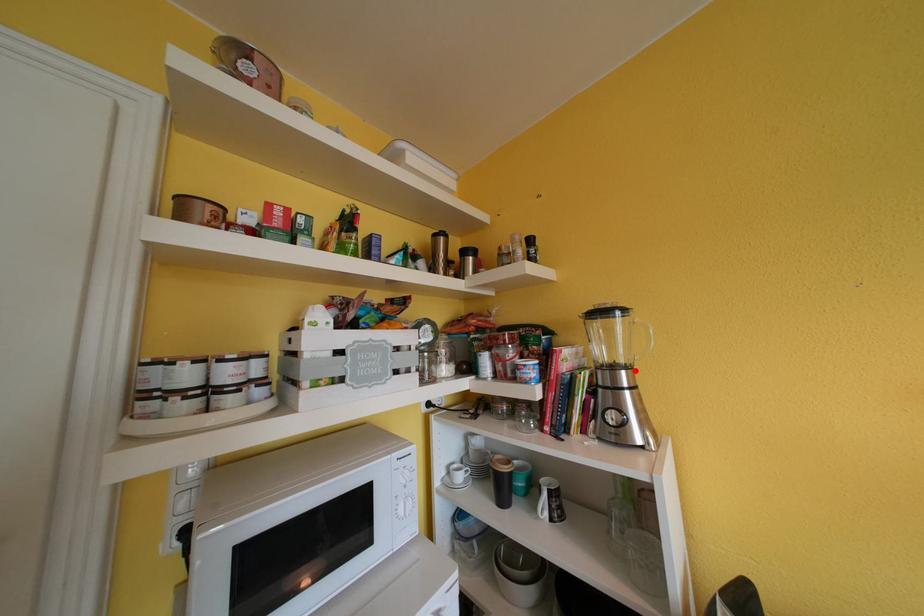
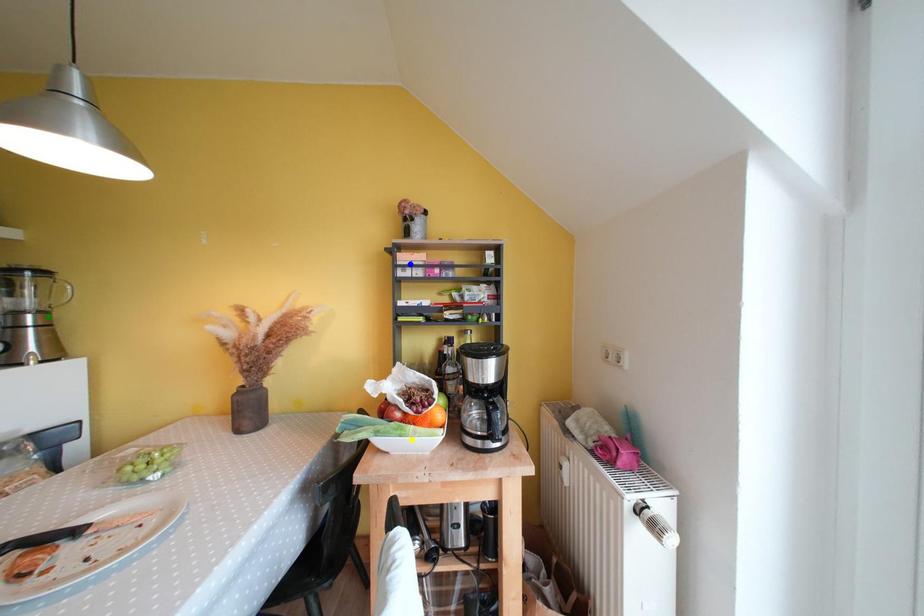
Question: I am providing you with two images of the same scene from different viewpoints. A red point is marked on the first image. You are given multiple points on the second image. Which spot in image 2 lines up with the point in image 1?

Choices:
 (A) blue point
 (B) green point
 (C) yellow point

Answer: (B)